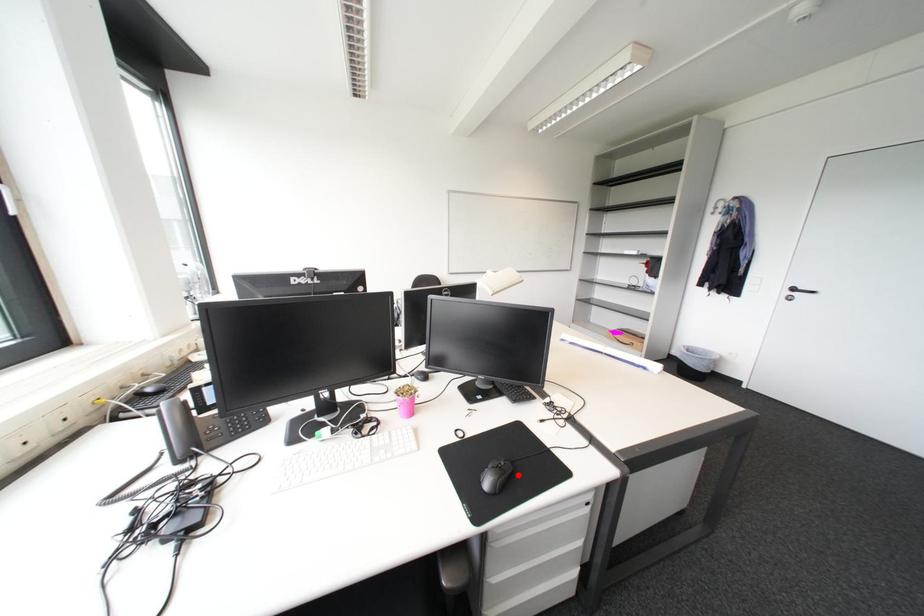
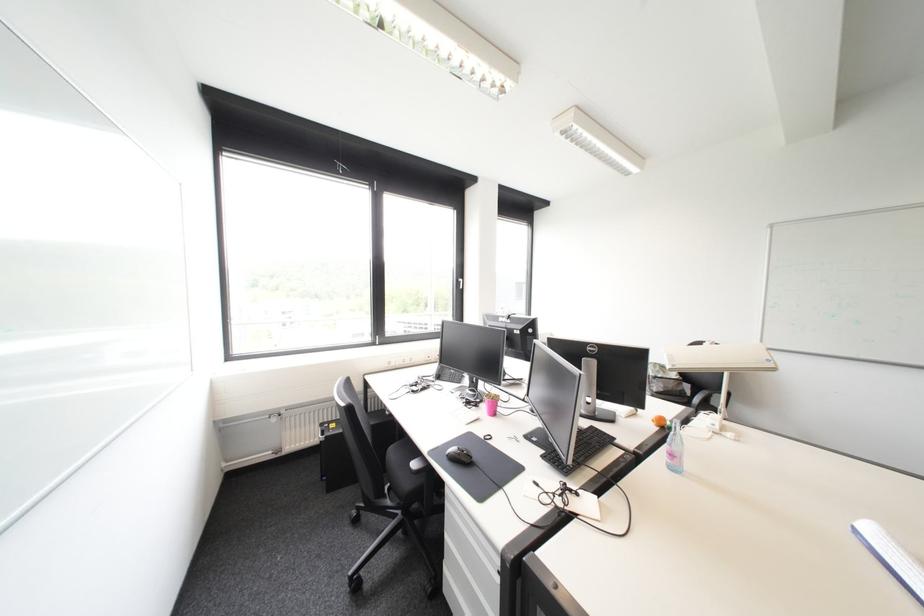
Find the pixel in the second image that matches the highlighted location in the first image.

(468, 458)